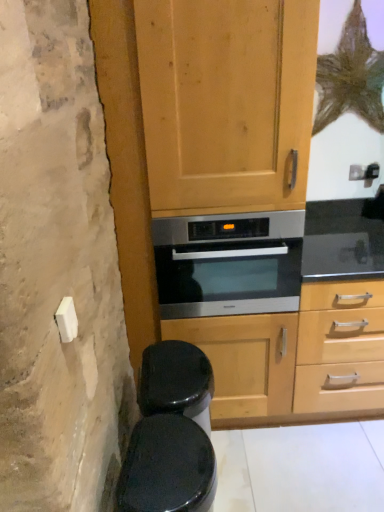
Question: In terms of height, does wooden cabinet at center look taller or shorter compared to stainless steel oven at center?

Choices:
 (A) tall
 (B) short

Answer: (A)

Question: Is wooden cabinet at center to the left or to the right of stainless steel oven at center in the image?

Choices:
 (A) left
 (B) right

Answer: (A)

Question: Which object is positioned farthest from the stainless steel oven at center?

Choices:
 (A) wooden cabinet at center
 (B) black glossy toilet bowl at lower left

Answer: (B)

Question: Estimate the real-world distances between objects in this image. Which object is closer to the wooden cabinet at center?

Choices:
 (A) black glossy toilet bowl at lower left
 (B) stainless steel oven at center

Answer: (B)